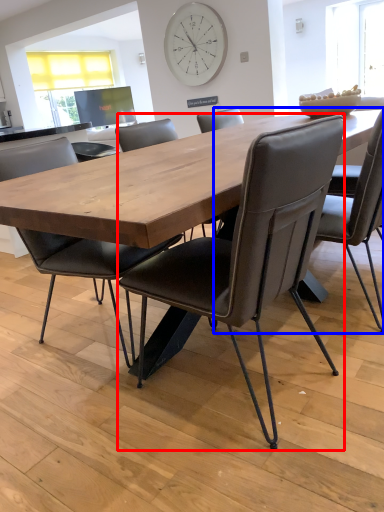
Question: Which object is further to the camera taking this photo, chair (highlighted by a red box) or chair (highlighted by a blue box)?

Choices:
 (A) chair
 (B) chair

Answer: (B)